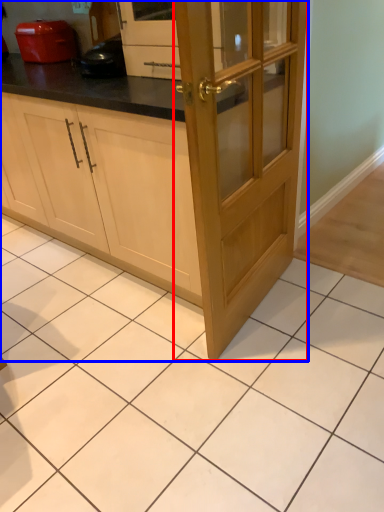
Question: Among these objects, which one is nearest to the camera, door (highlighted by a red box) or cabinetry (highlighted by a blue box)?

Choices:
 (A) door
 (B) cabinetry

Answer: (A)